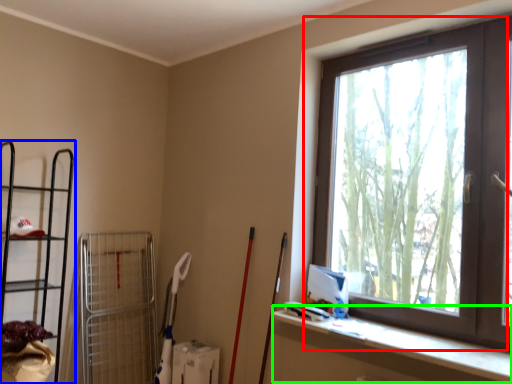
Question: Considering the real-world distances, which object is closest to window (highlighted by a red box)? shelf (highlighted by a blue box) or ledge (highlighted by a green box).

Choices:
 (A) shelf
 (B) ledge

Answer: (B)